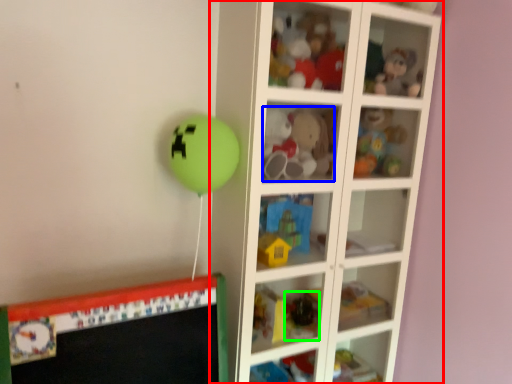
Question: Based on their relative distances, which object is nearer to shelf (highlighted by a red box)? Choose from toy (highlighted by a blue box) and toy (highlighted by a green box).

Choices:
 (A) toy
 (B) toy

Answer: (A)